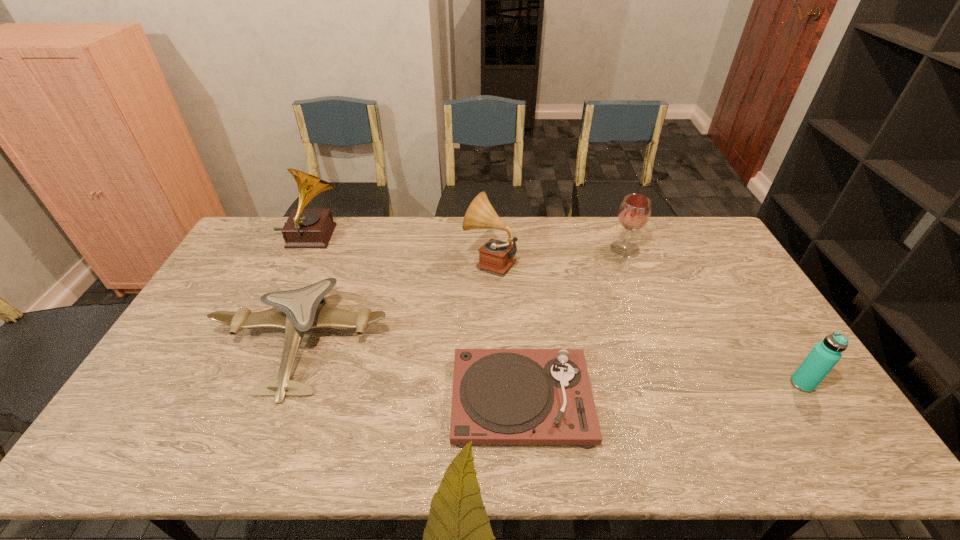
Identify the location of free spot located 0.240m on the horn of the second shortest phonograph_record. (395, 260).

Locate an element on the screen. vacant space located on the front of the wineglass is located at coordinates (641, 292).

Locate an element on the screen. This screenshot has width=960, height=540. free space located 0.250m on the back of the rightmost object is located at coordinates (754, 308).

Locate an element on the screen. free region located on the front-facing side of the second shortest object is located at coordinates (266, 437).

At what (x,y) coordinates should I click in order to perform the action: click on free space located 0.120m on the right of the nearest phonograph_record. Please return your answer as a coordinate pair (x, y). The height and width of the screenshot is (540, 960). Looking at the image, I should click on (636, 399).

Find the location of a particular element. This screenshot has height=540, width=960. wineglass that is at the far edge is located at coordinates (634, 212).

Identify the location of object at the near edge. Image resolution: width=960 pixels, height=540 pixels. (500, 396).

Where is `phonograph record present at the left edge`? The image size is (960, 540). phonograph record present at the left edge is located at coordinates (305, 228).

The height and width of the screenshot is (540, 960). Find the location of `drone located in the left edge section of the desktop`. drone located in the left edge section of the desktop is located at coordinates (296, 311).

This screenshot has height=540, width=960. What are the coordinates of `object that is at the right edge` in the screenshot? It's located at (824, 356).